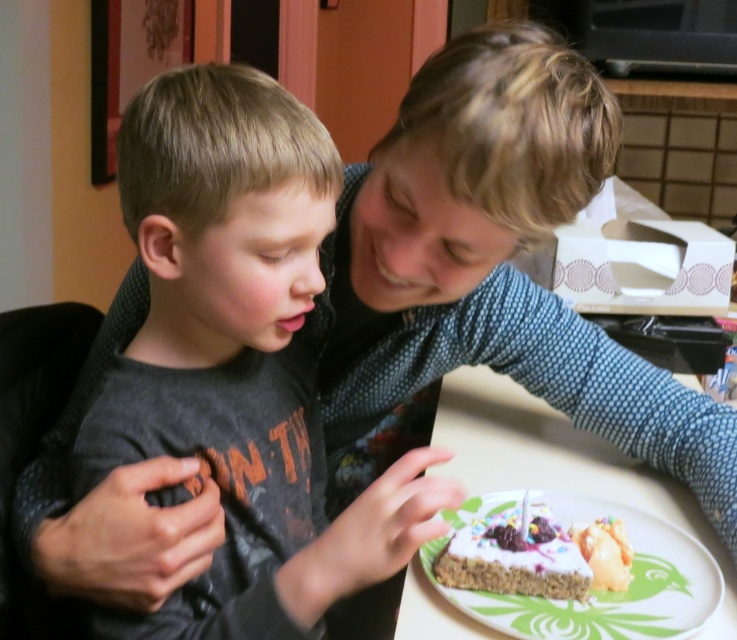
Where is the dark gray shirt at center located in the image?

The dark gray shirt at center is located at point (242,344).

You are a photographer standing in the room and want to capture a photo that includes both the white frosted cake at lower center and the white frosted cake at center. Given that your camera has a maximum focus range of 2 inches, will you be able to get both cakes in focus?

The distance between the white frosted cake at lower center and the white frosted cake at center is 2.18 inches. Since the camera can only focus within 2 inches, the two cakes are slightly out of the camera focus range. Therefore, you won t be able to get both in focus at the same time.